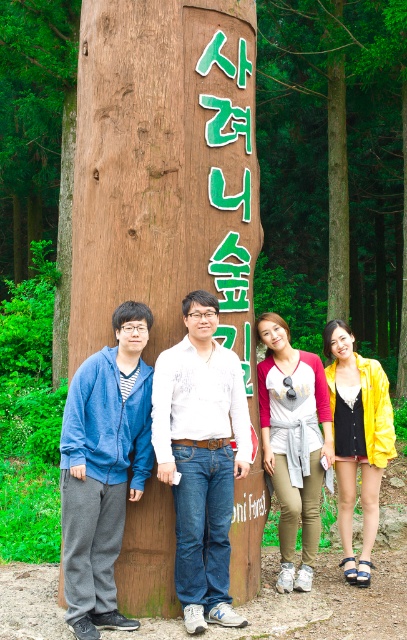
Consider the image. Is wooden signpost at center above red and white baseball jersey at center?

Yes.

Describe the element at coordinates (164, 168) in the screenshot. Image resolution: width=407 pixels, height=640 pixels. I see `wooden signpost at center` at that location.

At what (x,y) coordinates should I click in order to perform the action: click on wooden signpost at center. Please return your answer as a coordinate pair (x, y). The width and height of the screenshot is (407, 640). Looking at the image, I should click on (164, 168).

Is the position of white cotton shirt at center more distant than that of yellow shiny jacket at lower right?

No, white cotton shirt at center is in front of yellow shiny jacket at lower right.

The width and height of the screenshot is (407, 640). I want to click on white cotton shirt at center, so click(201, 458).

Locate an element on the screen. The height and width of the screenshot is (640, 407). white cotton shirt at center is located at coordinates (201, 458).

Is denim jacket at left to the left of red and white baseball jersey at center from the viewer's perspective?

Yes, denim jacket at left is to the left of red and white baseball jersey at center.

Between point (131, 369) and point (304, 451), which one is positioned in front?

Point (131, 369) is in front.

Is point (74, 513) less distant than point (293, 488)?

Yes, point (74, 513) is closer to viewer.

Where is `denim jacket at left`? denim jacket at left is located at coordinates (104, 468).